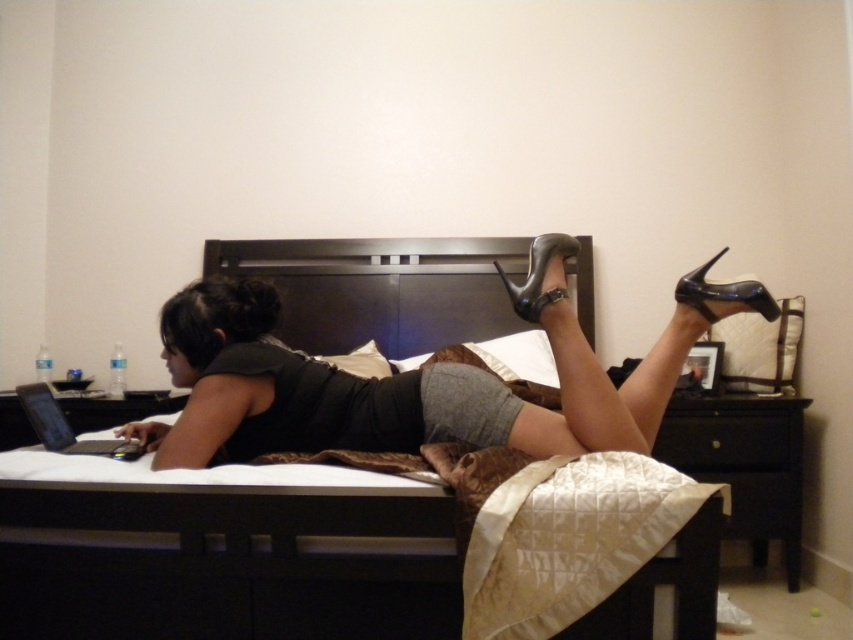
Is point (398, 528) farther from camera compared to point (312, 316)?

No.

Between point (387, 534) and point (474, 248), which one is positioned in front?

Point (387, 534) is in front.

The width and height of the screenshot is (853, 640). I want to click on dark wood bed at center, so click(x=225, y=563).

Which is below, dark wood bed at center or shiny black high-heeled shoe at upper center?

shiny black high-heeled shoe at upper center is lower down.

Does dark wood bed at center appear on the left side of shiny black high-heeled shoe at upper center?

Yes, dark wood bed at center is to the left of shiny black high-heeled shoe at upper center.

The width and height of the screenshot is (853, 640). Describe the element at coordinates (225, 563) in the screenshot. I see `dark wood bed at center` at that location.

The width and height of the screenshot is (853, 640). What are the coordinates of `dark wood bed at center` in the screenshot? It's located at pyautogui.click(x=225, y=563).

Between point (351, 253) and point (704, 316), which one is positioned behind?

Positioned behind is point (351, 253).

How distant is dark wood headboard at center from shiny black high-heeled shoe at upper right?

dark wood headboard at center and shiny black high-heeled shoe at upper right are 1.36 meters apart from each other.

Who is more forward, [386,326] or [741,308]?

Positioned in front is point [741,308].

Locate an element on the screen. The width and height of the screenshot is (853, 640). dark wood headboard at center is located at coordinates (381, 289).